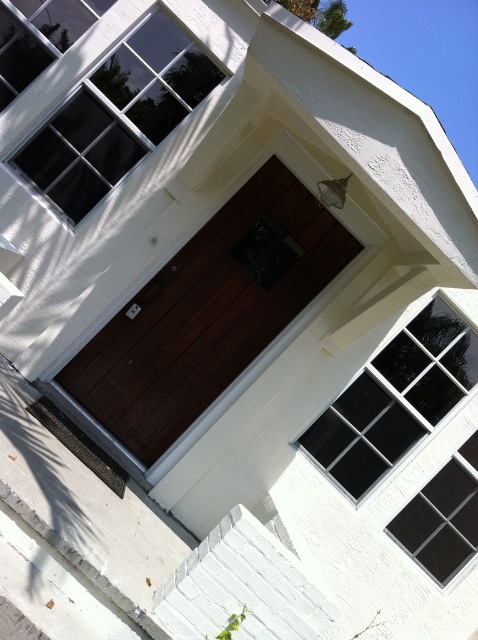
Question: Where is dark wood door at center located in relation to white painted wood stairs at lower center in the image?

Choices:
 (A) above
 (B) below

Answer: (A)

Question: Which of the following is the closest to the observer?

Choices:
 (A) dark wood door at center
 (B) white painted wood stairs at lower center

Answer: (B)

Question: Which point appears closest to the camera in this image?

Choices:
 (A) (196, 269)
 (B) (230, 600)

Answer: (B)

Question: Is dark wood door at center thinner than white painted wood stairs at lower center?

Choices:
 (A) no
 (B) yes

Answer: (A)

Question: Can you confirm if dark wood door at center is smaller than white painted wood stairs at lower center?

Choices:
 (A) no
 (B) yes

Answer: (A)